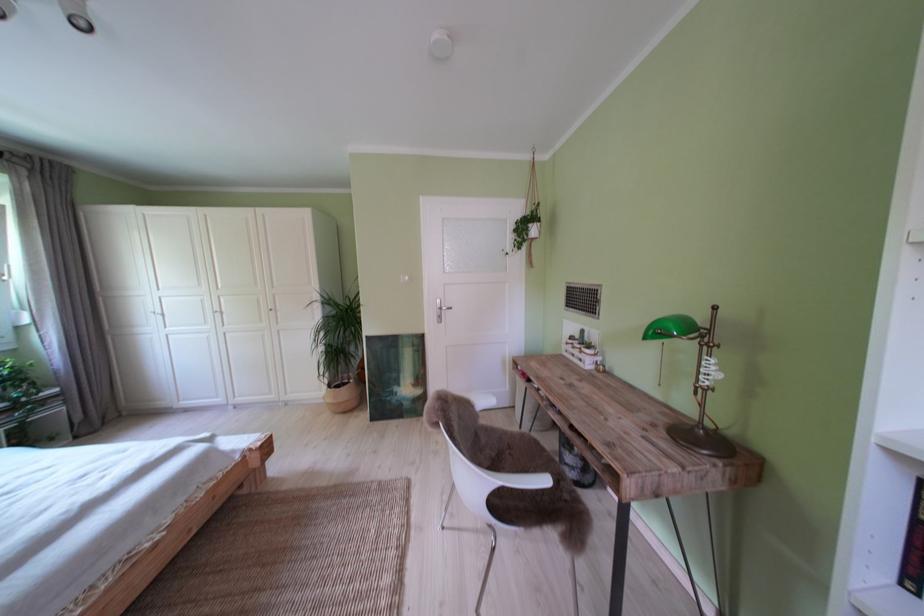
Find where to pull the lamp pull chain. Please return your answer as a coordinate pair (x, y).

(661, 374)